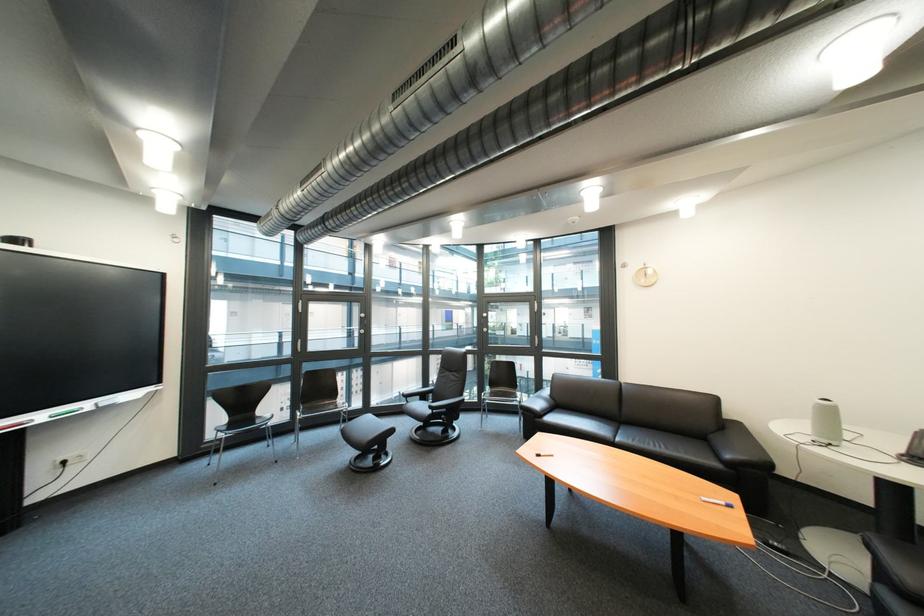
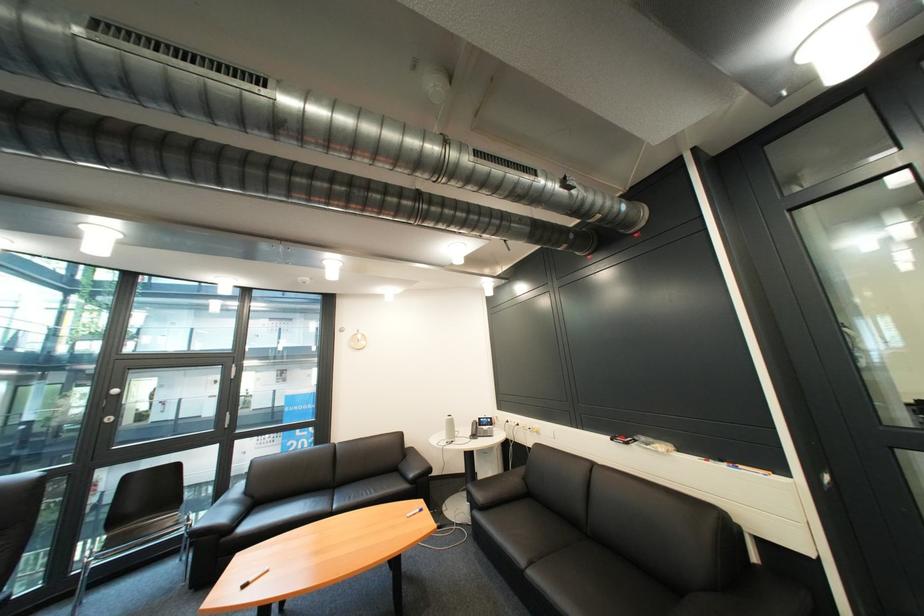
Question: The camera is either moving clockwise (left) or counter-clockwise (right) around the object. The first image is from the beginning of the video and the second image is from the end. Is the camera moving left or right when shooting the video?

Choices:
 (A) Left
 (B) Right

Answer: (A)